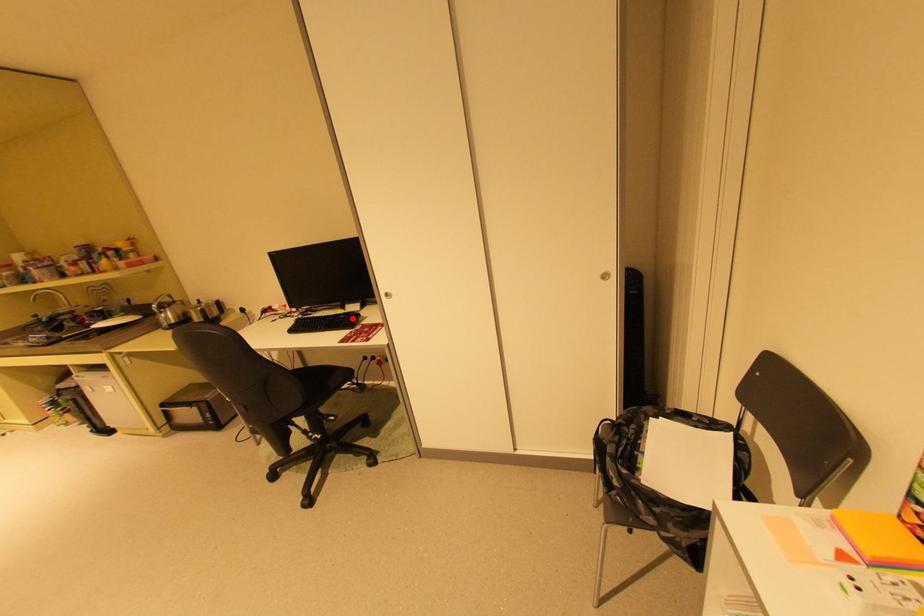
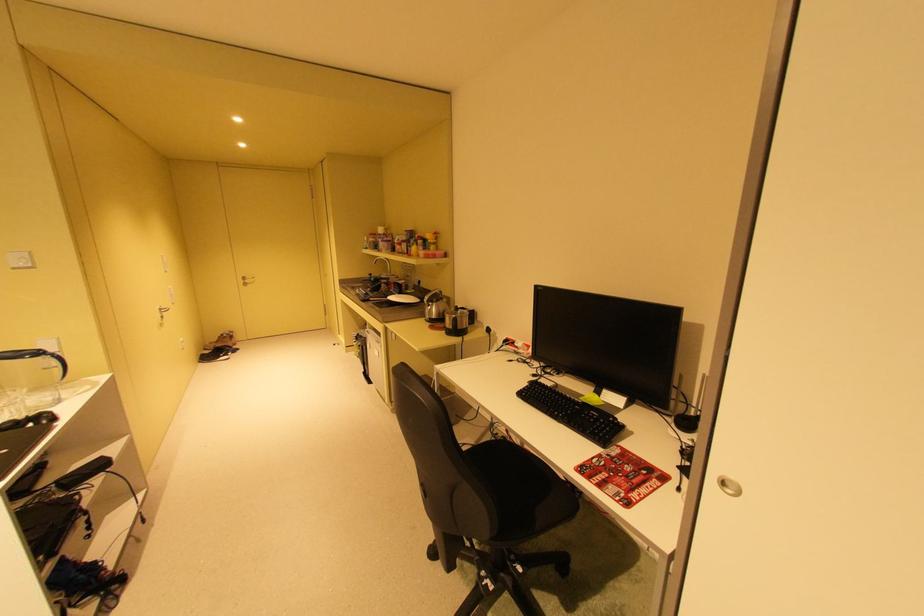
The point at the highlighted location is marked in the first image. Where is the corresponding point in the second image?

(604, 419)